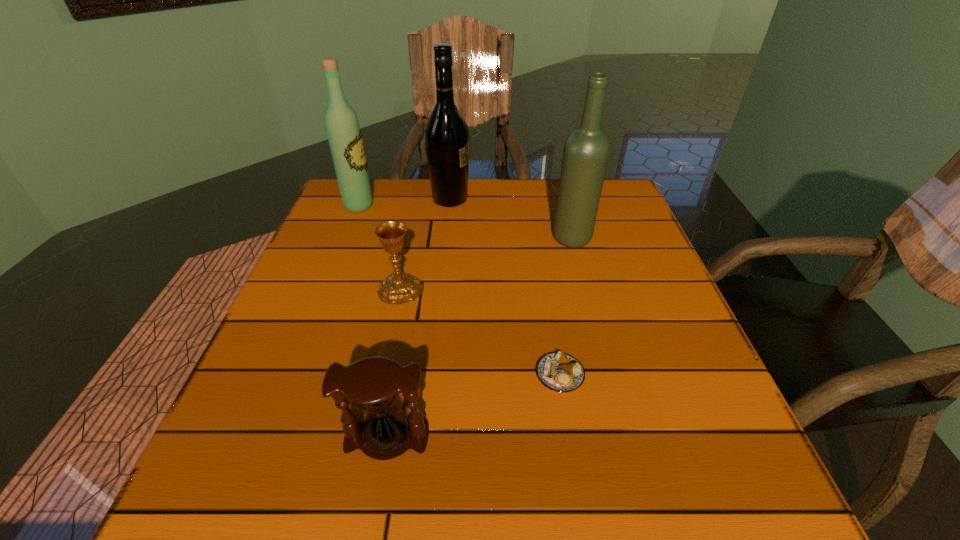
Where is `empty location between the chalice and the second wine bottle from left to right`? This screenshot has width=960, height=540. empty location between the chalice and the second wine bottle from left to right is located at coordinates (425, 244).

At what (x,y) coordinates should I click in order to perform the action: click on free area in between the pastry and the nearest object. Please return your answer as a coordinate pair (x, y). This screenshot has height=540, width=960. Looking at the image, I should click on (473, 407).

Locate which object ranks fourth in proximity to the third nearest object. Please provide its 2D coordinates. Your answer should be formatted as a tuple, i.e. [(x, y)], where the tuple contains the x and y coordinates of a point satisfying the conditions above.

[(446, 133)]

Point out which object is positioned as the fourth nearest to the pastry. Please provide its 2D coordinates. Your answer should be formatted as a tuple, i.e. [(x, y)], where the tuple contains the x and y coordinates of a point satisfying the conditions above.

[(446, 133)]

This screenshot has width=960, height=540. Find the location of `the closest wine bottle to the nearest wine bottle`. the closest wine bottle to the nearest wine bottle is located at coordinates (446, 133).

Locate an element on the screen. This screenshot has width=960, height=540. wine bottle that is the second closest to the second nearest object is located at coordinates (x=446, y=133).

Locate an element on the screen. This screenshot has width=960, height=540. vacant area in the image that satisfies the following two spatial constraints: 1. on the front-facing side of the leftmost wine bottle; 2. on the left side of the chalice is located at coordinates tap(326, 289).

Image resolution: width=960 pixels, height=540 pixels. I want to click on blank area in the image that satisfies the following two spatial constraints: 1. on the label of the second wine bottle from left to right; 2. on the right side of the fifth farthest object, so click(433, 375).

The width and height of the screenshot is (960, 540). What are the coordinates of `vacant space that satisfies the following two spatial constraints: 1. on the back side of the nearest object; 2. on the front-facing side of the leftmost wine bottle` in the screenshot? It's located at (427, 205).

Find the location of `vacant space that satisfies the following two spatial constraints: 1. on the label of the second wine bottle from right to left; 2. on the front side of the nearest object`. vacant space that satisfies the following two spatial constraints: 1. on the label of the second wine bottle from right to left; 2. on the front side of the nearest object is located at coordinates (427, 438).